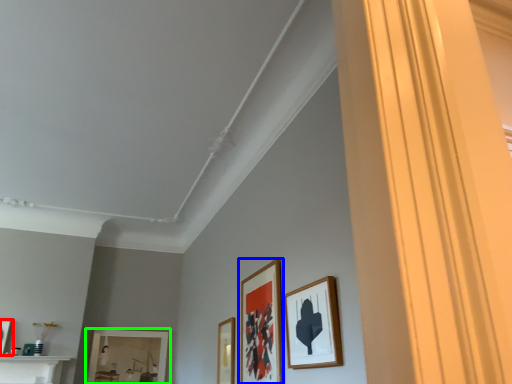
Question: Considering the real-world distances, which object is closest to picture frame (highlighted by a red box)? picture frame (highlighted by a blue box) or picture frame (highlighted by a green box).

Choices:
 (A) picture frame
 (B) picture frame

Answer: (B)